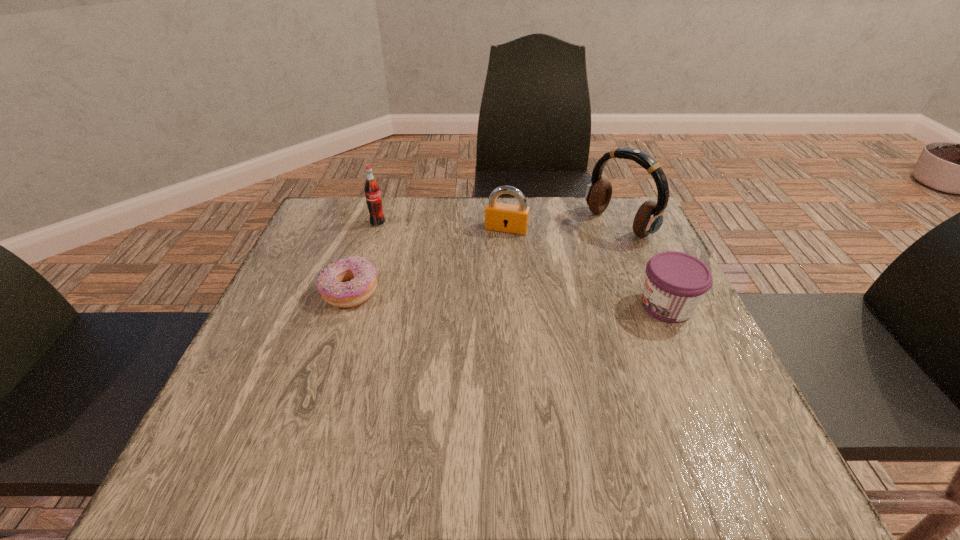
The height and width of the screenshot is (540, 960). In order to click on vacant region located on the label of the soda bottle in this screenshot , I will do `click(485, 292)`.

The height and width of the screenshot is (540, 960). Identify the location of free region located on the label of the soda bottle. (412, 245).

Locate an element on the screen. This screenshot has height=540, width=960. vacant space located on the label of the soda bottle is located at coordinates (433, 259).

Image resolution: width=960 pixels, height=540 pixels. Find the location of `vacant space situated 0.220m to unlock the third object from left to right from the front`. vacant space situated 0.220m to unlock the third object from left to right from the front is located at coordinates (480, 292).

The image size is (960, 540). I want to click on vacant space situated 0.390m to unlock the third object from left to right from the front, so click(458, 350).

The height and width of the screenshot is (540, 960). I want to click on vacant space situated 0.150m to unlock the third object from left to right from the front, so (x=488, y=272).

This screenshot has height=540, width=960. In order to click on blank area located 0.090m on the ear cup of the tallest object in this screenshot , I will do `click(575, 252)`.

Identify the location of vacant space situated on the ear cup of the tallest object. The width and height of the screenshot is (960, 540). (566, 256).

Where is `vacant area situated 0.370m on the ear cup of the tallest object`? This screenshot has height=540, width=960. vacant area situated 0.370m on the ear cup of the tallest object is located at coordinates (489, 303).

What are the coordinates of `soda bottle that is at the far edge` in the screenshot? It's located at (372, 190).